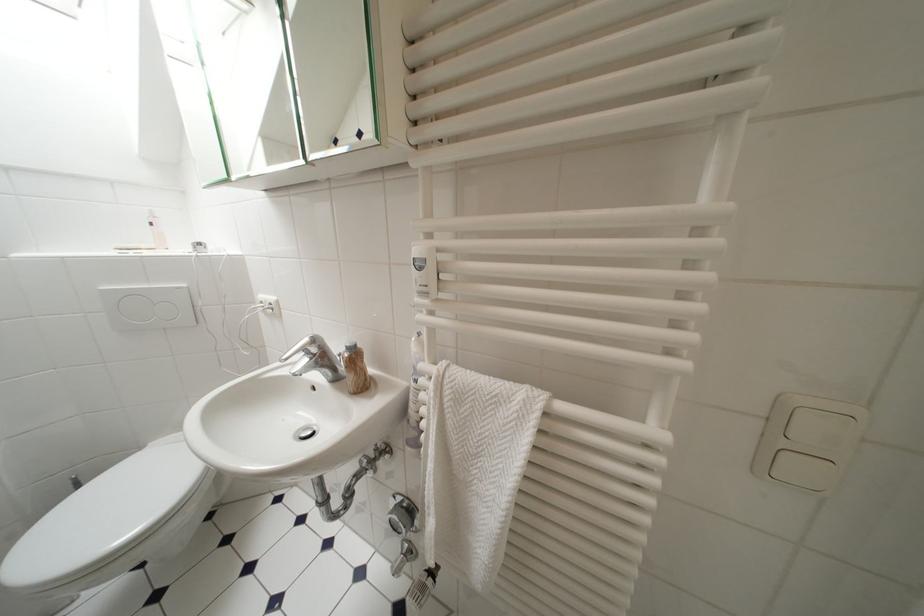
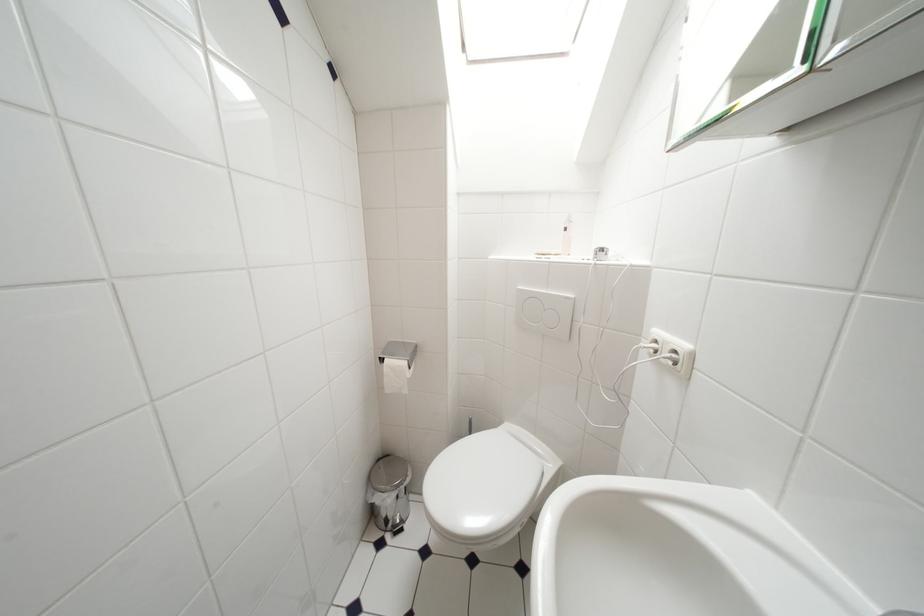
Question: The camera is either moving clockwise (left) or counter-clockwise (right) around the object. The first image is from the beginning of the video and the second image is from the end. Is the camera moving left or right when shooting the video?

Choices:
 (A) Left
 (B) Right

Answer: (B)